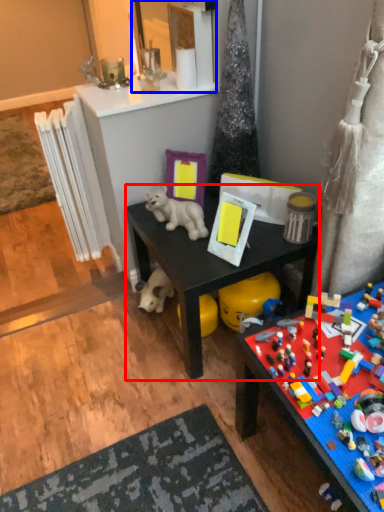
Question: Which object appears closest to the camera in this image, desk (highlighted by a red box) or mirror (highlighted by a blue box)?

Choices:
 (A) desk
 (B) mirror

Answer: (A)